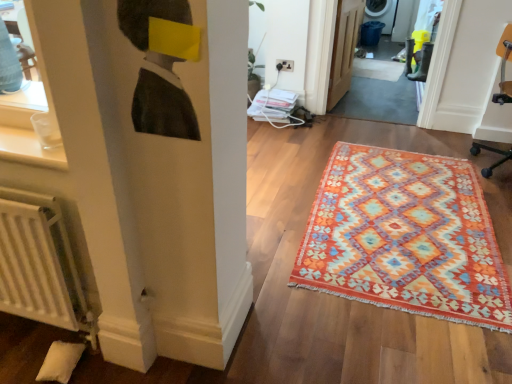
Find the location of a particular element. free point below white matte radiator at lower left (from a real-world perspective) is located at coordinates (41, 330).